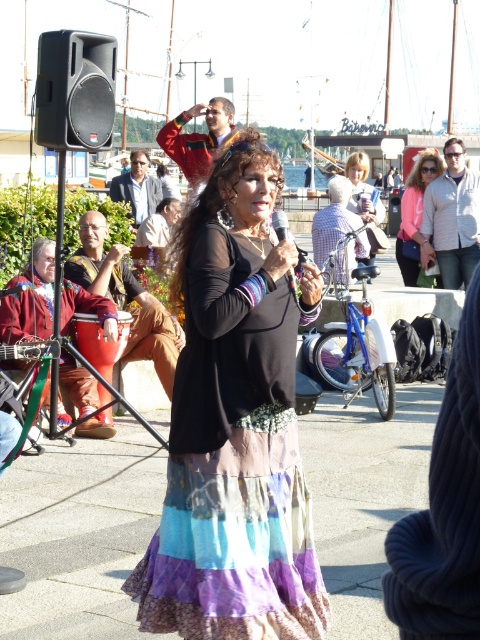
You are attending a festival and notice two items at the center of the scene. The multicolored patchwork skirt at center and the pink fabric purse at center. Which item is shorter in height?

The multicolored patchwork skirt at center is not as tall as the pink fabric purse at center, so the multicolored patchwork skirt at center is shorter in height.

You are a photographer trying to capture a clear shot of the light brown hair at center without the pink fabric purse at center blocking it. How can you adjust your position to achieve this?

The pink fabric purse at center is positioned over light brown hair at center. To avoid the purse blocking the hair, move your camera position slightly downward or to the side so that the purse is no longer in front of the hair.